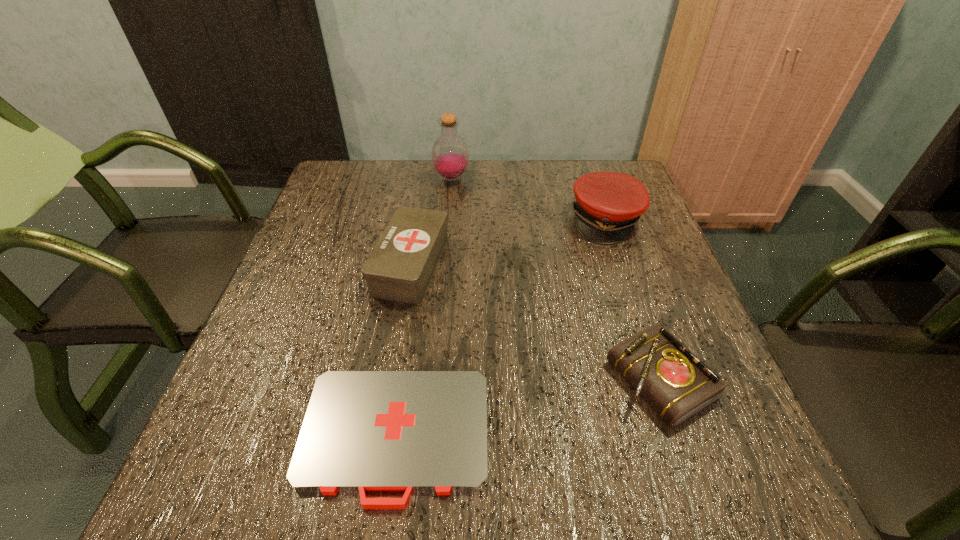
Where is `the farthest object`? The height and width of the screenshot is (540, 960). the farthest object is located at coordinates (450, 156).

Where is `the tallest object`? The image size is (960, 540). the tallest object is located at coordinates tap(450, 156).

At what (x,y) coordinates should I click in order to perform the action: click on cap. Please return your answer as a coordinate pair (x, y). Looking at the image, I should click on (608, 204).

Find the location of a particular element. The image size is (960, 540). the third tallest object is located at coordinates (400, 267).

The image size is (960, 540). I want to click on the farther first-aid kit, so click(x=400, y=267).

Find the location of a particular element. diary is located at coordinates (675, 383).

I want to click on the shortest object, so click(x=409, y=431).

Where is `the nearer first-aid kit`? the nearer first-aid kit is located at coordinates (409, 431).

Locate an element on the screen. This screenshot has width=960, height=540. free space located 0.130m on the left of the tallest object is located at coordinates click(x=389, y=179).

Where is `free region located on the front of the cap with an emblem`? This screenshot has width=960, height=540. free region located on the front of the cap with an emblem is located at coordinates (649, 347).